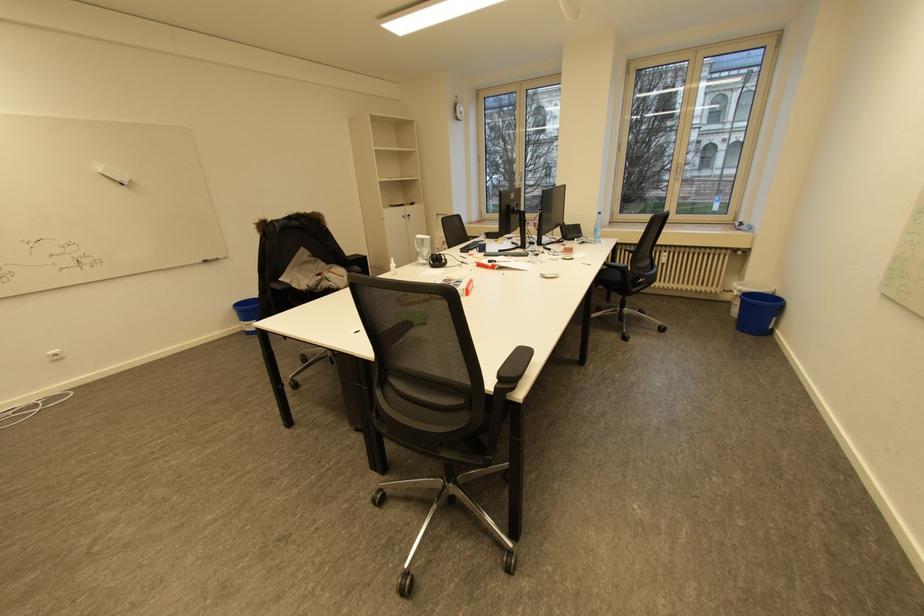
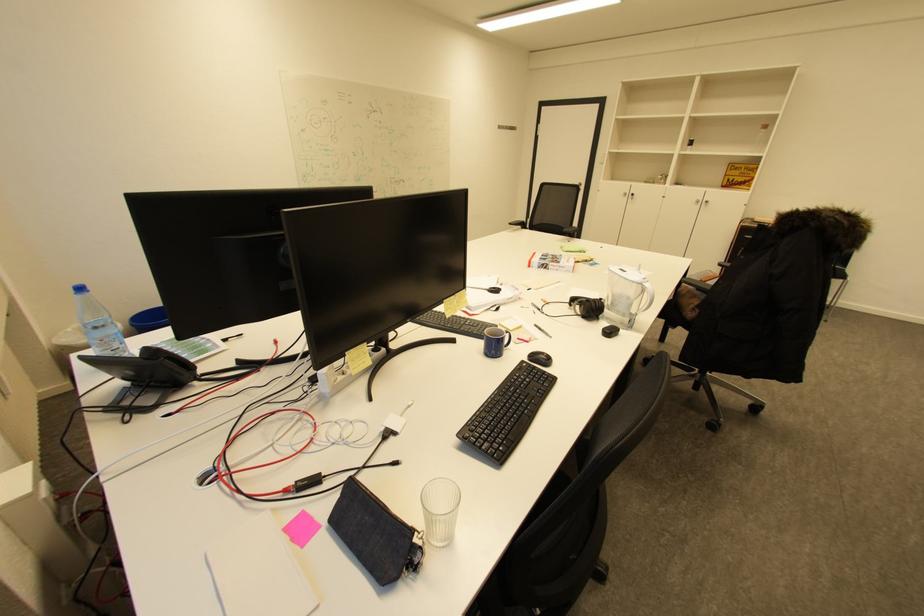
The point at (605, 214) is marked in the first image. Where is the corresponding point in the second image?

(88, 290)